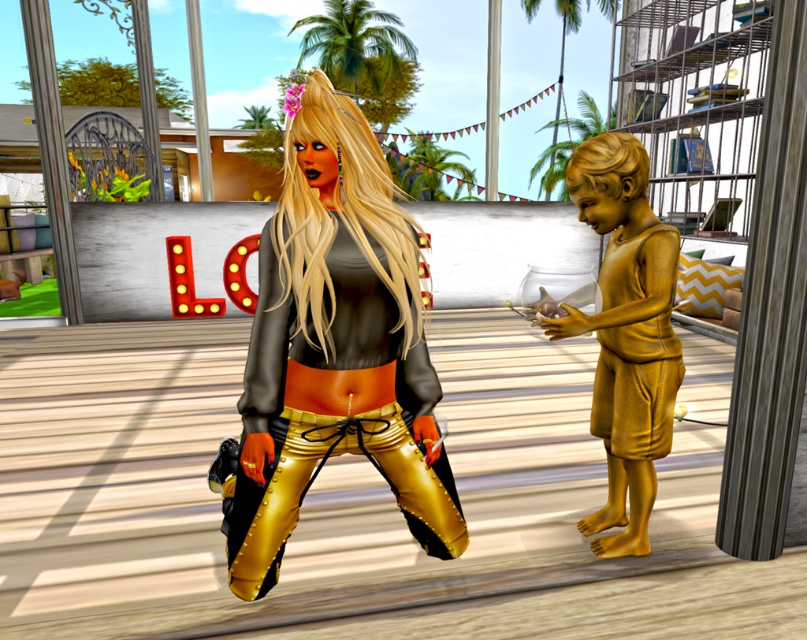
Question: Which point is closer to the camera?

Choices:
 (A) gold metallic statue at right
 (B) metallic gold pants at center

Answer: (B)

Question: Is metallic gold pants at center below gold metallic statue at right?

Choices:
 (A) no
 (B) yes

Answer: (A)

Question: Which point is farther to the camera?

Choices:
 (A) (659, 417)
 (B) (320, 339)

Answer: (A)

Question: Can you confirm if metallic gold pants at center is wider than gold metallic statue at right?

Choices:
 (A) no
 (B) yes

Answer: (B)

Question: Is the position of metallic gold pants at center more distant than that of gold metallic statue at right?

Choices:
 (A) yes
 (B) no

Answer: (B)